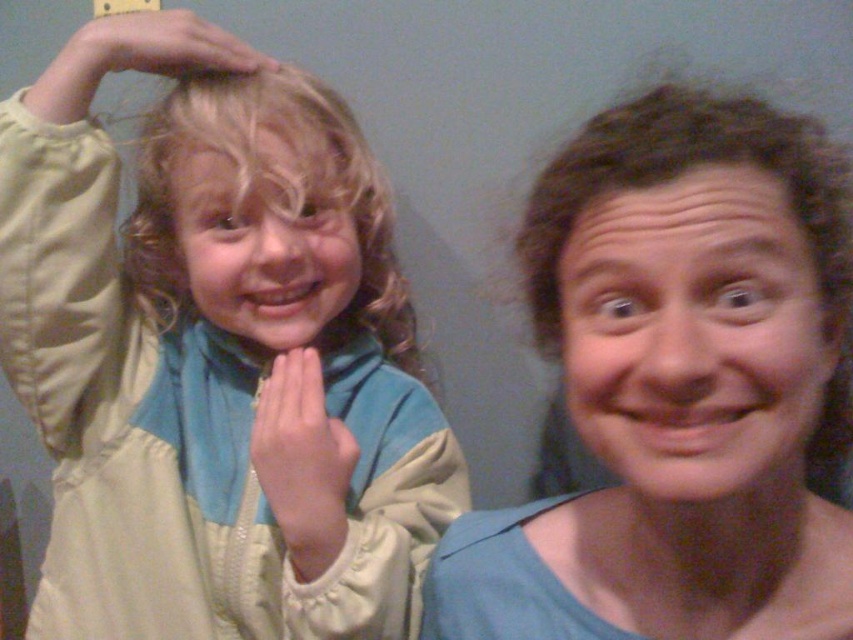
Is matte blue shirt at center shorter than matte yellow hand at upper left?

Incorrect, matte blue shirt at center's height does not fall short of matte yellow hand at upper left's.

Who is taller, matte blue shirt at center or matte yellow hand at upper left?

Standing taller between the two is matte blue shirt at center.

Between point (775, 483) and point (125, 61), which one is positioned behind?

Positioned behind is point (125, 61).

You are a GUI agent. You are given a task and a screenshot of the screen. Output one action in this format:
    pyautogui.click(x=<x>, y=<y>)
    Task: Click on the matte blue shirt at center
    
    Given the screenshot: What is the action you would take?
    pyautogui.click(x=679, y=387)

Which is more to the left, matte blue shirt at center or pink flesh-toned hand at center?

From the viewer's perspective, pink flesh-toned hand at center appears more on the left side.

Which is in front, point (538, 323) or point (305, 461)?

Point (538, 323)

This screenshot has height=640, width=853. Identify the location of matte blue shirt at center. (679, 387).

Which is above, matte beige jacket at left or blonde curly hair at upper left?

blonde curly hair at upper left

Is matte beige jacket at left wider than blonde curly hair at upper left?

Yes, matte beige jacket at left is wider than blonde curly hair at upper left.

In order to click on matte beige jacket at left in this screenshot , I will do `click(218, 371)`.